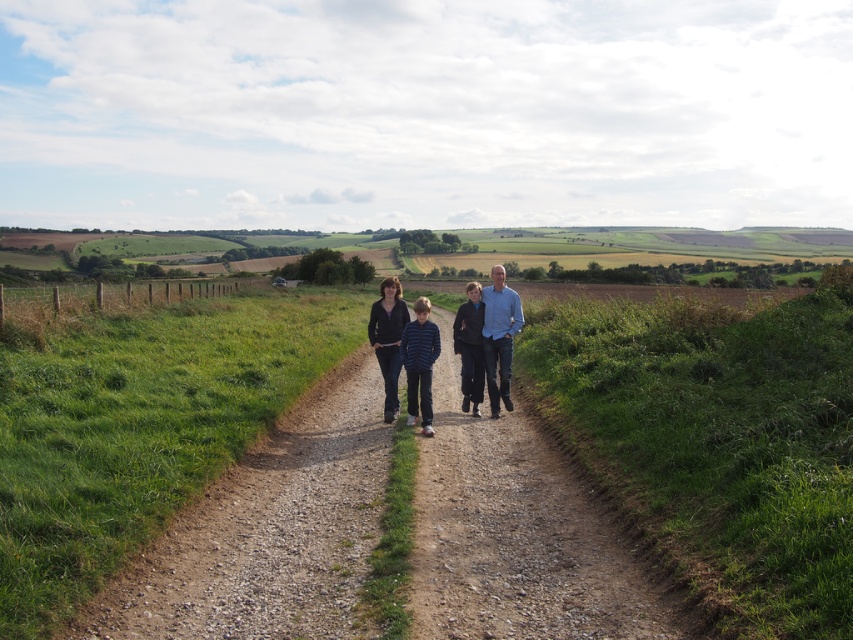
Is light blue shirt at center thinner than matte black jacket at center?

Yes, light blue shirt at center is thinner than matte black jacket at center.

Does light blue shirt at center come in front of matte black jacket at center?

No, light blue shirt at center is behind matte black jacket at center.

Which is behind, point (492, 376) or point (383, 420)?

The point (492, 376) is behind.

This screenshot has width=853, height=640. In order to click on light blue shirt at center in this screenshot , I will do `click(498, 337)`.

Which is more to the left, blue denim jeans at center or light blue shirt at center?

Positioned to the left is blue denim jeans at center.

Which of these two, blue denim jeans at center or light blue shirt at center, stands shorter?

With less height is light blue shirt at center.

Which is in front, point (483, 374) or point (492, 348)?

Point (492, 348) is more forward.

The height and width of the screenshot is (640, 853). Find the location of `blue denim jeans at center`. blue denim jeans at center is located at coordinates (474, 346).

Does light blue shirt at center appear on the right side of dark blue jeans at center?

Yes, light blue shirt at center is to the right of dark blue jeans at center.

Does light blue shirt at center have a lesser width compared to dark blue jeans at center?

Yes, light blue shirt at center is thinner than dark blue jeans at center.

This screenshot has width=853, height=640. What are the coordinates of `light blue shirt at center` in the screenshot? It's located at (498, 337).